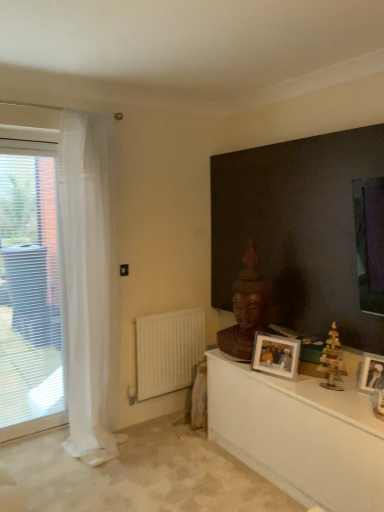
What are the coordinates of `vacant region to the right of transparent glass window at left` in the screenshot? It's located at (56, 443).